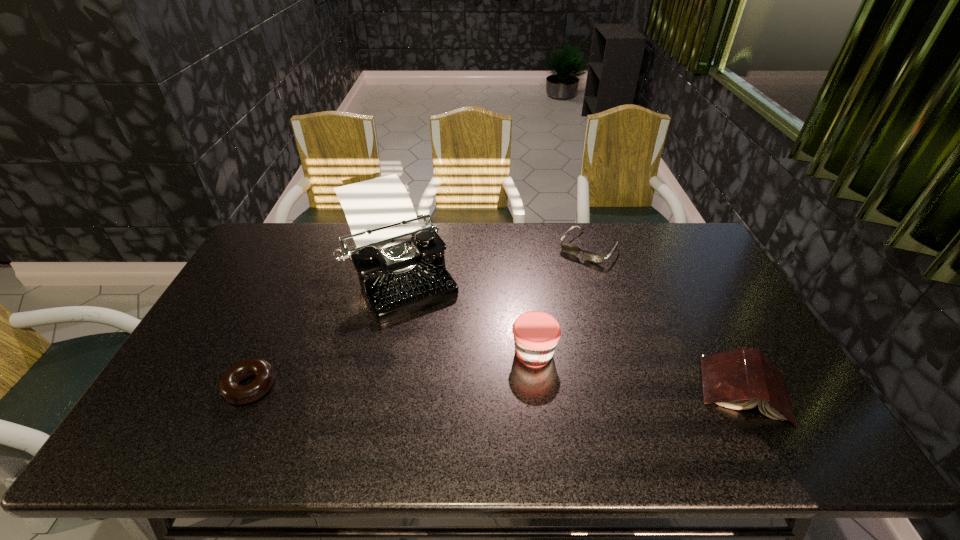
Identify the location of free space at the far right corner. (686, 240).

Locate an element on the screen. vacant area that lies between the jam and the tallest object is located at coordinates (466, 311).

I want to click on free space between the book and the leftmost object, so click(x=497, y=388).

At what (x,y) coordinates should I click in order to perform the action: click on free space between the third tallest object and the third object from right to left. Please return your answer as a coordinate pair (x, y). Looking at the image, I should click on (639, 371).

Find the location of a particular element. This screenshot has height=540, width=960. vacant area between the third shortest object and the typewriter is located at coordinates (571, 329).

What are the coordinates of `vacant area that lies between the book and the doughnut` in the screenshot? It's located at (497, 388).

Locate an element on the screen. Image resolution: width=960 pixels, height=540 pixels. vacant area that lies between the rightmost object and the leftmost object is located at coordinates (497, 388).

You are a GUI agent. You are given a task and a screenshot of the screen. Output one action in this format:
    pyautogui.click(x=<x>, y=<y>)
    Task: Click on the free area in between the sunglasses and the third object from left to right
    
    Given the screenshot: What is the action you would take?
    561,300

Identify the location of free space between the second object from right to left and the tallest object. click(x=492, y=259).

The image size is (960, 540). Find the location of `free spot between the third shortest object and the sunglasses`. free spot between the third shortest object and the sunglasses is located at coordinates (666, 319).